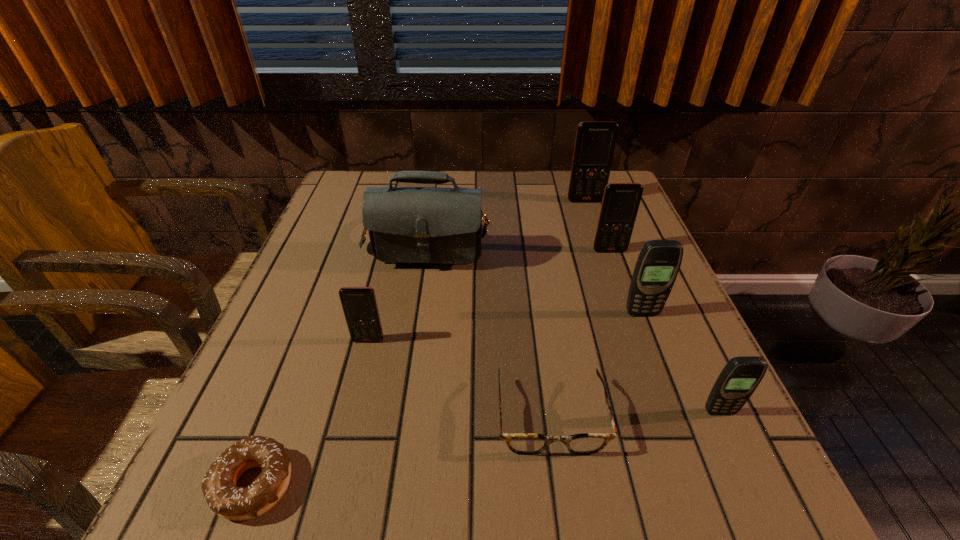
Where is `blank area at the near edge`? This screenshot has width=960, height=540. blank area at the near edge is located at coordinates (497, 469).

The width and height of the screenshot is (960, 540). Find the location of `free region at the left edge of the desktop`. free region at the left edge of the desktop is located at coordinates (321, 233).

Where is `free space at the right edge of the desktop`? free space at the right edge of the desktop is located at coordinates (641, 393).

Where is `blank area at the far left corner`? blank area at the far left corner is located at coordinates (386, 182).

In the image, there is a desktop. Where is `blank space at the near right corner`? The image size is (960, 540). blank space at the near right corner is located at coordinates pos(663,488).

This screenshot has width=960, height=540. Find the location of `free space that is in between the nearer gray cellular telephone and the spectacles`. free space that is in between the nearer gray cellular telephone and the spectacles is located at coordinates (635, 414).

Locate an element on the screen. The height and width of the screenshot is (540, 960). free spot between the farthest orange cellular telephone and the nearest orange cellular telephone is located at coordinates (x=477, y=271).

At what (x,y) coordinates should I click in order to perform the action: click on vacant area that lies between the tallest cellular telephone and the chocolate doughnut. Please return your answer as a coordinate pair (x, y). Image resolution: width=960 pixels, height=540 pixels. Looking at the image, I should click on (420, 342).

I want to click on free spot between the chocolate doughnut and the second farthest orange cellular telephone, so click(432, 367).

I want to click on vacant space in between the second nearest orange cellular telephone and the smallest orange cellular telephone, so click(489, 295).